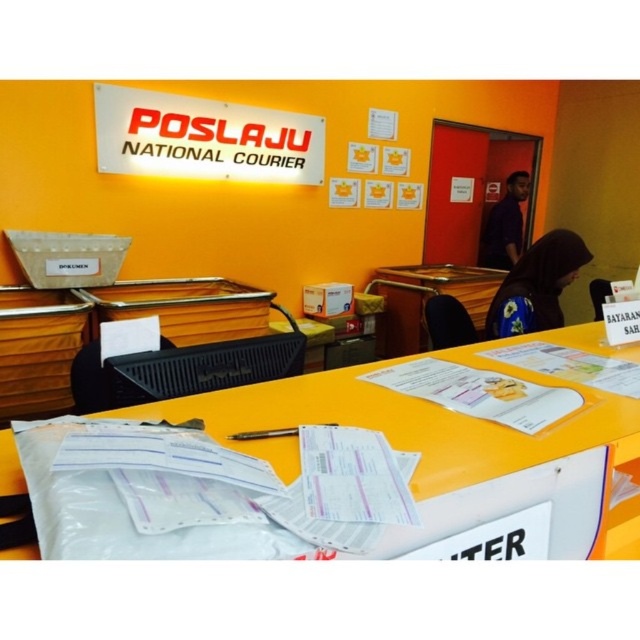
Between floral fabric hijab at lower right and orange matte table at center, which one has more height?

floral fabric hijab at lower right

Can you confirm if floral fabric hijab at lower right is thinner than orange matte table at center?

No.

Between point (552, 301) and point (16, 556), which one is positioned behind?

Point (552, 301)

You are a GUI agent. You are given a task and a screenshot of the screen. Output one action in this format:
    pyautogui.click(x=<x>, y=<y>)
    Task: Click on the floral fabric hijab at lower right
    This screenshot has height=640, width=640.
    Given the screenshot: What is the action you would take?
    pyautogui.click(x=536, y=285)

Is floral fabric hijab at lower right wider than purple matte shirt at upper right?

Yes.

The width and height of the screenshot is (640, 640). Find the location of `floral fabric hijab at lower right`. floral fabric hijab at lower right is located at coordinates (536, 285).

Image resolution: width=640 pixels, height=640 pixels. Identify the location of floral fabric hijab at lower right. (536, 285).

From the picture: Can you confirm if yellow plastic table at center is taller than purple matte shirt at upper right?

Incorrect, yellow plastic table at center's height is not larger of purple matte shirt at upper right's.

Between yellow plastic table at center and purple matte shirt at upper right, which one appears on the right side from the viewer's perspective?

From the viewer's perspective, purple matte shirt at upper right appears more on the right side.

Who is more forward, (444, 262) or (506, 236)?

Point (444, 262) is more forward.

You are a GUI agent. You are given a task and a screenshot of the screen. Output one action in this format:
    pyautogui.click(x=<x>, y=<y>)
    Task: Click on the yellow plastic table at center
    
    Given the screenshot: What is the action you would take?
    pyautogui.click(x=426, y=300)